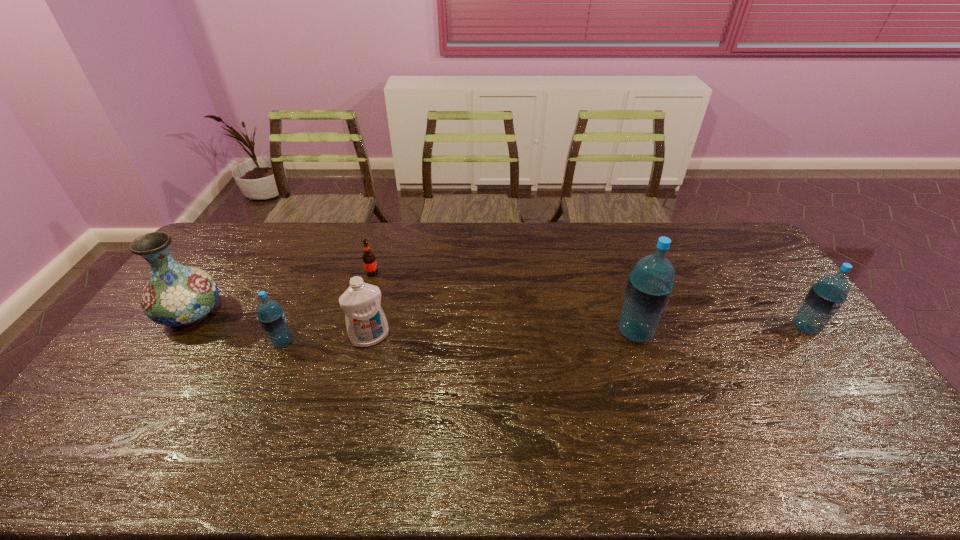
Locate an element on the screen. the fifth tallest object is located at coordinates (271, 316).

Where is `the leftmost water bottle`? Image resolution: width=960 pixels, height=540 pixels. the leftmost water bottle is located at coordinates (271, 316).

Find the location of a particular element. The image size is (960, 540). the tallest object is located at coordinates (650, 284).

Identify the location of the tallest water bottle. The height and width of the screenshot is (540, 960). (650, 284).

The image size is (960, 540). In order to click on the rightmost water bottle in this screenshot , I will do `click(825, 298)`.

Locate an element on the screen. This screenshot has height=540, width=960. the second tallest water bottle is located at coordinates (825, 298).

Find the location of a particular element. the farthest object is located at coordinates (369, 261).

Locate an element on the screen. The image size is (960, 540). root beer is located at coordinates (369, 261).

At what (x,y) coordinates should I click in order to perform the action: click on vase. Please return your answer as a coordinate pair (x, y). Image resolution: width=960 pixels, height=540 pixels. Looking at the image, I should click on (179, 296).

At what (x,y) coordinates should I click in order to perform the action: click on detergent. Please return your answer as a coordinate pair (x, y). Looking at the image, I should click on (366, 323).